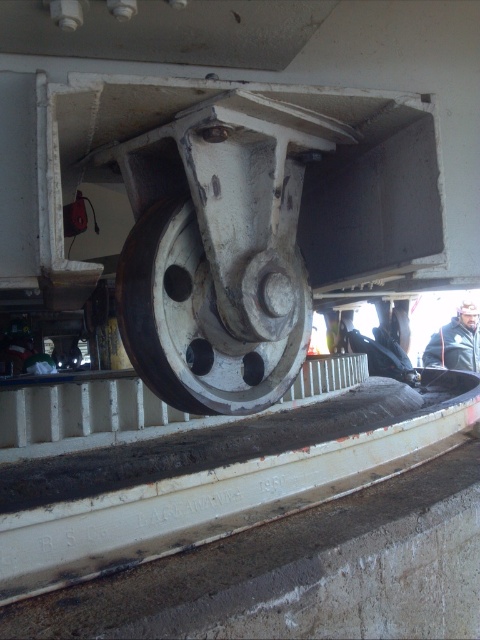
Question: Does white matte wheel at center appear over dark blue jacket at lower right?

Choices:
 (A) no
 (B) yes

Answer: (B)

Question: Which point is farther to the camera?

Choices:
 (A) (213, 330)
 (B) (441, 356)

Answer: (B)

Question: Does white matte wheel at center appear under dark blue jacket at lower right?

Choices:
 (A) no
 (B) yes

Answer: (A)

Question: Which object is closer to the camera taking this photo?

Choices:
 (A) white matte wheel at center
 (B) dark blue jacket at lower right

Answer: (A)

Question: Can you confirm if white matte wheel at center is positioned below dark blue jacket at lower right?

Choices:
 (A) yes
 (B) no

Answer: (B)